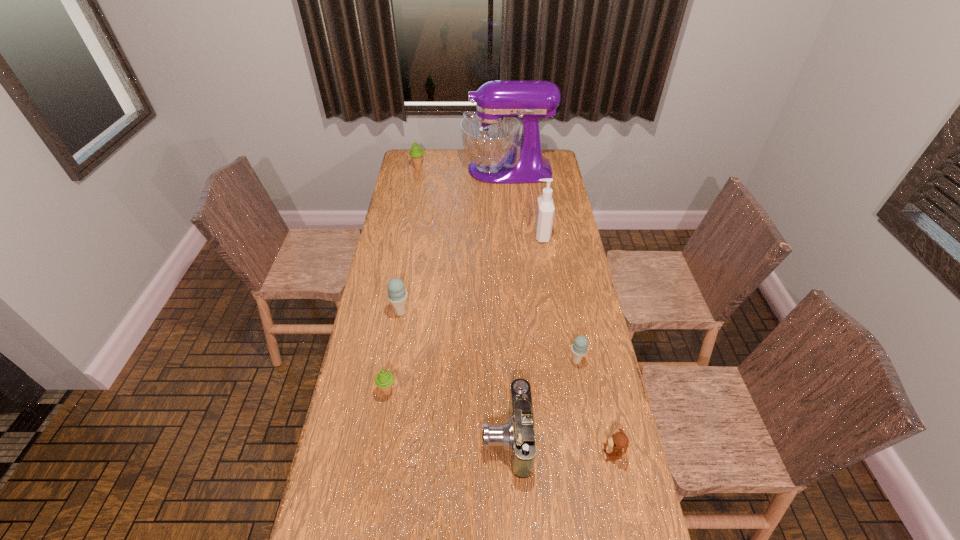
This screenshot has width=960, height=540. In order to click on purple mixer in this screenshot , I will do `click(490, 136)`.

This screenshot has height=540, width=960. I want to click on mixer, so click(490, 136).

This screenshot has height=540, width=960. Find the location of `cleansing agent`. cleansing agent is located at coordinates (545, 209).

Locate an element on the screen. The height and width of the screenshot is (540, 960). the sixth nearest object is located at coordinates (545, 209).

Locate an element on the screen. the bigger green icecream is located at coordinates (416, 153).

The height and width of the screenshot is (540, 960). Identify the location of the farther green icecream. (416, 153).

Identify the location of the farther blue ice cream. (397, 295).

At what (x,y) coordinates should I click in order to perform the action: click on the bigger blue ice cream. Please return your answer as a coordinate pair (x, y). The image size is (960, 540). Looking at the image, I should click on (397, 295).

You are a GUI agent. You are given a task and a screenshot of the screen. Output one action in this format:
    pyautogui.click(x=<x>, y=<y>)
    Task: Click on the blue camcorder
    The width and height of the screenshot is (960, 540).
    Given the screenshot: What is the action you would take?
    pyautogui.click(x=517, y=435)

Find the location of a particular element. The width and height of the screenshot is (960, 540). the sixth farthest object is located at coordinates (384, 379).